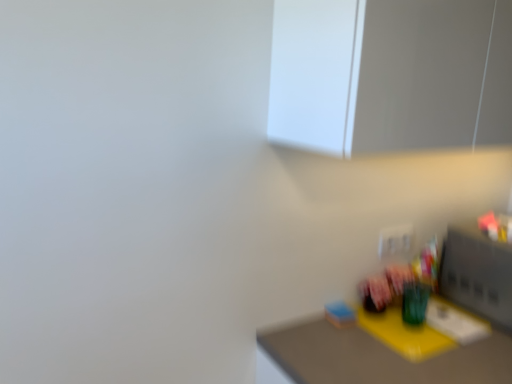
Locate an element on the screen. The image size is (512, 384). empty space that is ontop of yellow matte table at lower right (from a real-world perspective) is located at coordinates click(422, 345).